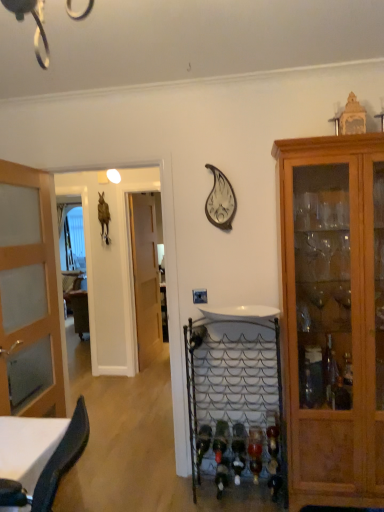
Locate an element on the screen. Image resolution: width=384 pixels, height=512 pixels. vacant space that is to the left of metallic wire wine rack at center is located at coordinates [181, 495].